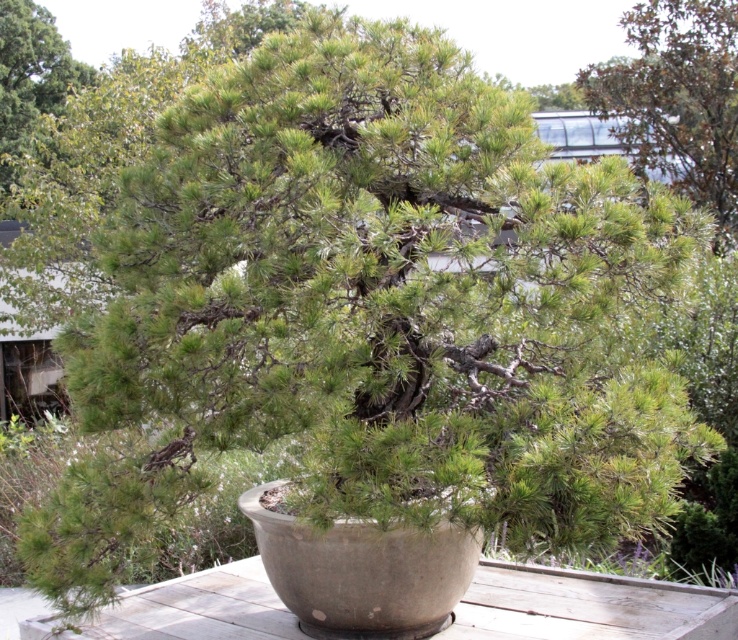
Question: Is green needle-like at upper right to the left of green matte tree at upper left from the viewer's perspective?

Choices:
 (A) yes
 (B) no

Answer: (B)

Question: Which object appears closest to the camera in this image?

Choices:
 (A) green needle-like at upper right
 (B) green matte tree at upper left

Answer: (A)

Question: In this image, where is green needle-like at upper right located relative to green matte tree at upper left?

Choices:
 (A) left
 (B) right

Answer: (B)

Question: Which of the following is the closest to the observer?

Choices:
 (A) (725, 216)
 (B) (15, 120)

Answer: (A)

Question: Which of the following is the farthest from the observer?

Choices:
 (A) [x=714, y=67]
 (B) [x=30, y=88]

Answer: (B)

Question: Does green needle-like at upper right appear on the right side of green matte tree at upper left?

Choices:
 (A) yes
 (B) no

Answer: (A)